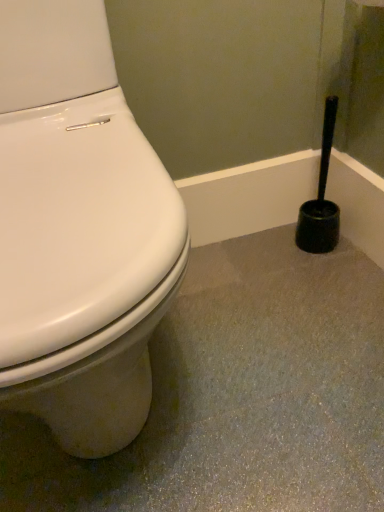
Question: Does point (336, 103) appear closer or farther from the camera than point (56, 348)?

Choices:
 (A) farther
 (B) closer

Answer: (A)

Question: Is black plastic toilet brush at right bigger or smaller than white glossy toilet at left?

Choices:
 (A) big
 (B) small

Answer: (B)

Question: From the image's perspective, is black plastic toilet brush at right positioned above or below white glossy toilet at left?

Choices:
 (A) above
 (B) below

Answer: (A)

Question: Is white glossy toilet at left in front of or behind black plastic toilet brush at right in the image?

Choices:
 (A) behind
 (B) front

Answer: (B)

Question: Choose the correct answer: Is white glossy toilet at left inside black plastic toilet brush at right or outside it?

Choices:
 (A) outside
 (B) inside

Answer: (A)

Question: Considering the relative positions of white glossy toilet at left and black plastic toilet brush at right in the image provided, is white glossy toilet at left to the left or to the right of black plastic toilet brush at right?

Choices:
 (A) left
 (B) right

Answer: (A)

Question: Considering the positions of white glossy toilet at left and black plastic toilet brush at right in the image, is white glossy toilet at left taller or shorter than black plastic toilet brush at right?

Choices:
 (A) tall
 (B) short

Answer: (A)